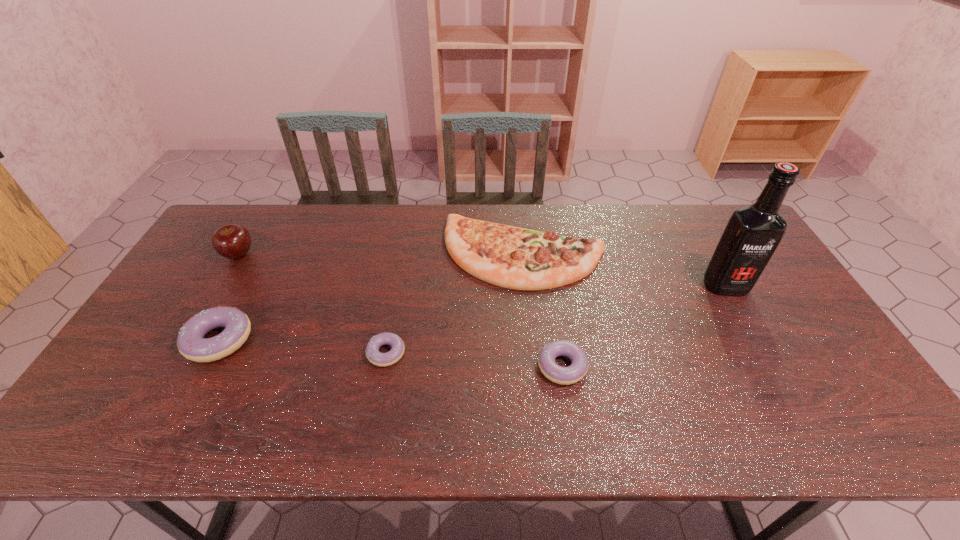
I want to click on empty space that is in between the third object from left to right and the pizza, so click(455, 303).

The image size is (960, 540). I want to click on unoccupied position between the shortest object and the tallest doughnut, so click(x=302, y=347).

This screenshot has height=540, width=960. I want to click on vacant region between the apple and the leftmost doughnut, so click(x=228, y=297).

The height and width of the screenshot is (540, 960). In order to click on vacant area between the fifth shortest object and the shortest object in this screenshot , I will do `click(312, 303)`.

Where is `object that is the fourth closest to the leftmost doughnut`? The image size is (960, 540). object that is the fourth closest to the leftmost doughnut is located at coordinates (577, 370).

At what (x,y) coordinates should I click in order to perform the action: click on the closest object relative to the second tallest object. Please return your answer as a coordinate pair (x, y). The width and height of the screenshot is (960, 540). Looking at the image, I should click on tap(191, 343).

I want to click on the second closest doughnut relative to the rightmost doughnut, so click(191, 343).

Locate an element on the screen. The image size is (960, 540). the closest doughnut to the leftmost doughnut is located at coordinates 394,355.

Identify the location of free location that satisfies the following two spatial constraints: 1. on the front side of the fifth shortest object; 2. on the right side of the second shortest doughnut. (171, 366).